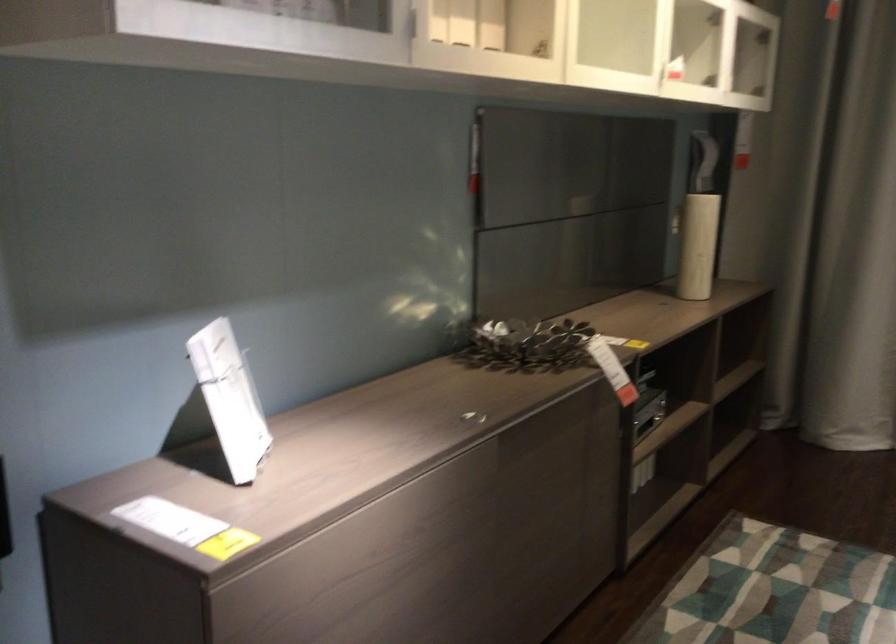
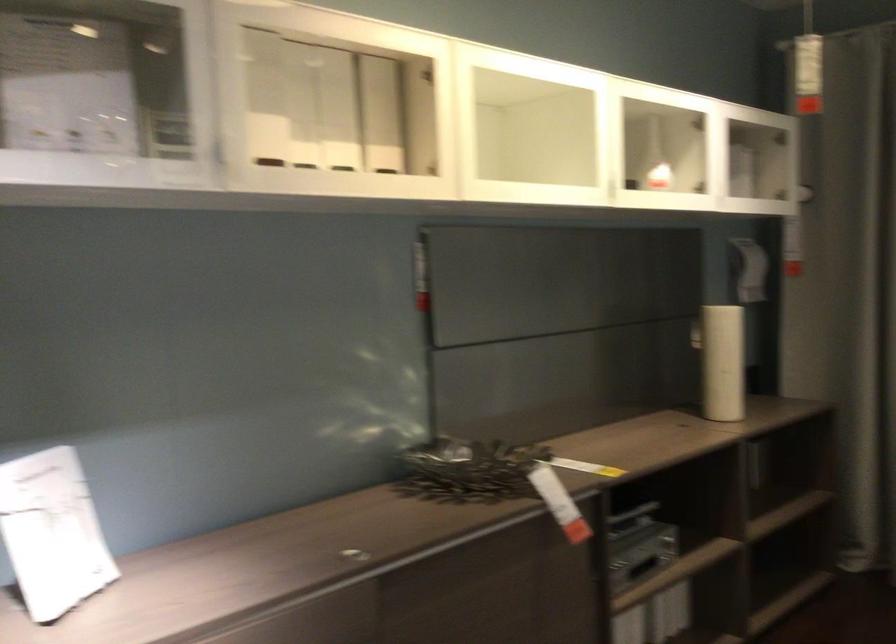
Question: Which direction would the cameraman need to move to produce the second image? Reply with the corresponding letter.

Choices:
 (A) Left
 (B) Right
 (C) Forward
 (D) Backward

Answer: (B)